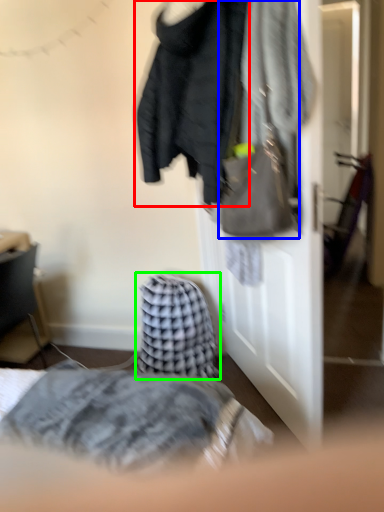
Question: Considering the real-world distances, which object is closest to jacket (highlighted by a red box)? handbag (highlighted by a blue box) or blanket (highlighted by a green box).

Choices:
 (A) handbag
 (B) blanket

Answer: (A)